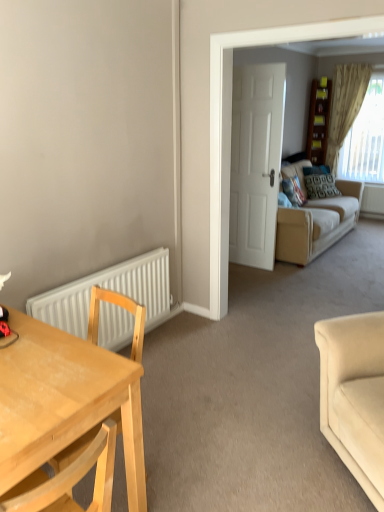
Question: Does patterned fabric pillow at center, which appears as the 1th pillow when viewed from the right, appear on the left side of white matte radiator at lower left?

Choices:
 (A) yes
 (B) no

Answer: (B)

Question: Can you confirm if patterned fabric pillow at center, the second pillow when ordered from front to back, is thinner than white matte radiator at lower left?

Choices:
 (A) no
 (B) yes

Answer: (A)

Question: Is white matte radiator at lower left at the back of patterned fabric pillow at center, which appears as the 1th pillow when viewed from the right?

Choices:
 (A) yes
 (B) no

Answer: (B)

Question: Considering the relative sizes of patterned fabric pillow at center, positioned as the 2th pillow in left-to-right order, and white matte radiator at lower left in the image provided, is patterned fabric pillow at center, positioned as the 2th pillow in left-to-right order, shorter than white matte radiator at lower left?

Choices:
 (A) no
 (B) yes

Answer: (B)

Question: Does patterned fabric pillow at center, the second pillow when ordered from front to back, have a larger size compared to white matte radiator at lower left?

Choices:
 (A) no
 (B) yes

Answer: (A)

Question: Considering the relative sizes of patterned fabric pillow at center, the second pillow when ordered from front to back, and white matte radiator at lower left in the image provided, is patterned fabric pillow at center, the second pillow when ordered from front to back, smaller than white matte radiator at lower left?

Choices:
 (A) yes
 (B) no

Answer: (A)

Question: Considering the relative sizes of beige textured curtain at upper right and white matte door at center in the image provided, is beige textured curtain at upper right thinner than white matte door at center?

Choices:
 (A) yes
 (B) no

Answer: (B)

Question: From a real-world perspective, is beige textured curtain at upper right positioned under white matte door at center based on gravity?

Choices:
 (A) no
 (B) yes

Answer: (A)

Question: Does beige textured curtain at upper right have a lesser height compared to white matte door at center?

Choices:
 (A) yes
 (B) no

Answer: (A)

Question: Is beige textured curtain at upper right in front of white matte door at center?

Choices:
 (A) no
 (B) yes

Answer: (A)

Question: Would you say beige textured curtain at upper right is outside white matte door at center?

Choices:
 (A) yes
 (B) no

Answer: (A)

Question: Is beige textured curtain at upper right positioned with its back to white matte door at center?

Choices:
 (A) yes
 (B) no

Answer: (B)

Question: Can you confirm if beige textured curtain at upper right is wider than white matte radiator at lower left?

Choices:
 (A) no
 (B) yes

Answer: (B)